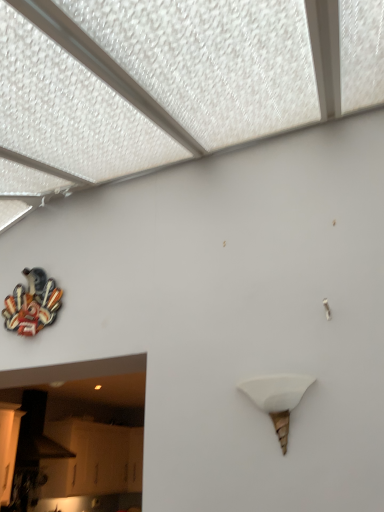
What is the approximate height of white matte cone at center-right?

white matte cone at center-right is 11.94 inches in height.

The image size is (384, 512). I want to click on white matte cone at center-right, so click(277, 398).

This screenshot has height=512, width=384. What do you see at coordinates (277, 398) in the screenshot? I see `white matte cone at center-right` at bounding box center [277, 398].

What is the approximate width of white matte cone at center-right?

The width of white matte cone at center-right is 16.55 centimeters.

What do you see at coordinates (32, 304) in the screenshot? Image resolution: width=384 pixels, height=512 pixels. I see `metallic/multicolored sculpture at upper left` at bounding box center [32, 304].

Where is `metallic/multicolored sculpture at upper left`? The image size is (384, 512). metallic/multicolored sculpture at upper left is located at coordinates (32, 304).

Identify the location of white matte cone at center-right. The image size is (384, 512). (277, 398).

Is white matte cone at center-right to the left of metallic/multicolored sculpture at upper left from the viewer's perspective?

Incorrect, white matte cone at center-right is not on the left side of metallic/multicolored sculpture at upper left.

Does white matte cone at center-right come in front of metallic/multicolored sculpture at upper left?

Yes, it is in front of metallic/multicolored sculpture at upper left.

Is point (300, 386) less distant than point (44, 278)?

Yes, it is in front of point (44, 278).

From the image's perspective, would you say white matte cone at center-right is shown under metallic/multicolored sculpture at upper left?

Indeed, from the image's perspective, white matte cone at center-right is shown beneath metallic/multicolored sculpture at upper left.

From a real-world perspective, does white matte cone at center-right sit lower than metallic/multicolored sculpture at upper left?

Yes, from a real-world perspective, white matte cone at center-right is beneath metallic/multicolored sculpture at upper left.

Based on the photo, considering the sizes of objects white matte cone at center-right and metallic/multicolored sculpture at upper left in the image provided, who is wider, white matte cone at center-right or metallic/multicolored sculpture at upper left?

white matte cone at center-right is wider.

Which of these two, white matte cone at center-right or metallic/multicolored sculpture at upper left, stands taller?

Standing taller between the two is metallic/multicolored sculpture at upper left.

Based on the photo, who is bigger, white matte cone at center-right or metallic/multicolored sculpture at upper left?

Bigger between the two is metallic/multicolored sculpture at upper left.

Can we say white matte cone at center-right lies outside metallic/multicolored sculpture at upper left?

Yes, white matte cone at center-right is outside of metallic/multicolored sculpture at upper left.

Can you see white matte cone at center-right touching metallic/multicolored sculpture at upper left?

No, white matte cone at center-right is not next to metallic/multicolored sculpture at upper left.

Is metallic/multicolored sculpture at upper left at the back of white matte cone at center-right?

No.

The image size is (384, 512). I want to click on art above the white matte cone at center-right (from a real-world perspective), so click(32, 304).

From the picture: Would you say metallic/multicolored sculpture at upper left is to the left or to the right of white matte cone at center-right in the picture?

metallic/multicolored sculpture at upper left is positioned on white matte cone at center-right's left side.

Which object is closer to the camera taking this photo, metallic/multicolored sculpture at upper left or white matte cone at center-right?

white matte cone at center-right is more forward.

Does point (19, 321) come behind point (277, 408)?

Yes, point (19, 321) is farther from viewer.

From the image's perspective, relative to white matte cone at center-right, is metallic/multicolored sculpture at upper left above or below?

Clearly, from the image's perspective, metallic/multicolored sculpture at upper left is above white matte cone at center-right.

From a real-world perspective, which is physically above, metallic/multicolored sculpture at upper left or white matte cone at center-right?

In real-world perspective, metallic/multicolored sculpture at upper left is above.

Considering the relative sizes of metallic/multicolored sculpture at upper left and white matte cone at center-right in the image provided, is metallic/multicolored sculpture at upper left thinner than white matte cone at center-right?

Indeed, metallic/multicolored sculpture at upper left has a lesser width compared to white matte cone at center-right.

In the scene shown: Considering the relative sizes of metallic/multicolored sculpture at upper left and white matte cone at center-right in the image provided, is metallic/multicolored sculpture at upper left taller than white matte cone at center-right?

Yes.

Does metallic/multicolored sculpture at upper left have a larger size compared to white matte cone at center-right?

Yes, metallic/multicolored sculpture at upper left is bigger than white matte cone at center-right.

Would you say metallic/multicolored sculpture at upper left is outside white matte cone at center-right?

Yes, metallic/multicolored sculpture at upper left is outside of white matte cone at center-right.

Is metallic/multicolored sculpture at upper left positioned far away from white matte cone at center-right?

Yes.

Looking at this image, is metallic/multicolored sculpture at upper left facing away from white matte cone at center-right?

No, white matte cone at center-right is not at the back of metallic/multicolored sculpture at upper left.

Measure the distance from metallic/multicolored sculpture at upper left to white matte cone at center-right.

They are 1.33 meters apart.

The height and width of the screenshot is (512, 384). Identify the location of lamp on the right of metallic/multicolored sculpture at upper left. (277, 398).

Identify the location of lamp that appears below the metallic/multicolored sculpture at upper left (from the image's perspective). (277, 398).

At what (x,y) coordinates should I click in order to perform the action: click on art above the white matte cone at center-right (from a real-world perspective). Please return your answer as a coordinate pair (x, y). Image resolution: width=384 pixels, height=512 pixels. Looking at the image, I should click on (32, 304).